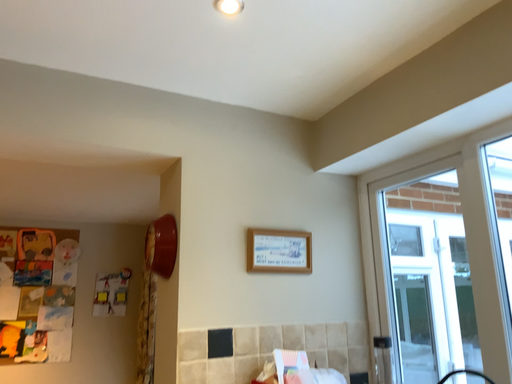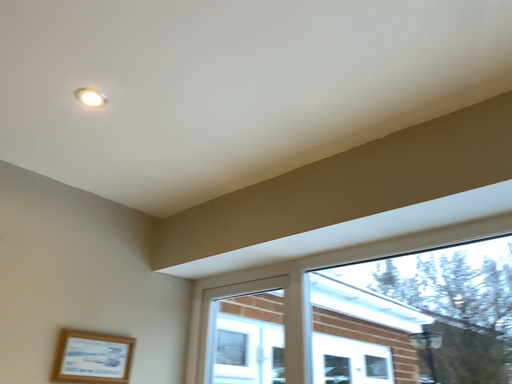
Question: How did the camera likely rotate when shooting the video?

Choices:
 (A) rotated left
 (B) rotated right

Answer: (B)